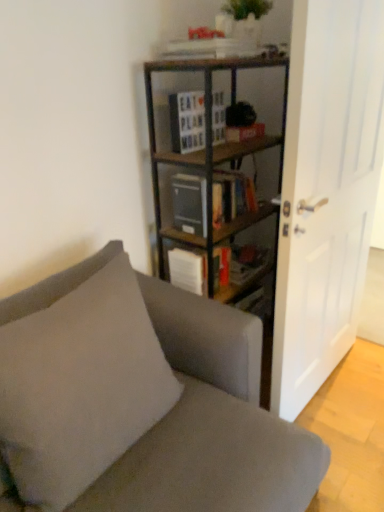
Question: From the image's perspective, would you say wooden sign at center, the 2th book ordered from the bottom, is positioned over wooden bookcase at center?

Choices:
 (A) no
 (B) yes

Answer: (B)

Question: Is wooden sign at center, the 2th book ordered from the bottom, behind wooden bookcase at center?

Choices:
 (A) no
 (B) yes

Answer: (B)

Question: Does wooden sign at center, the 2th book ordered from the bottom, have a lesser width compared to wooden bookcase at center?

Choices:
 (A) no
 (B) yes

Answer: (B)

Question: Is wooden sign at center, arranged as the 1th book when viewed from the top, at the right side of wooden bookcase at center?

Choices:
 (A) yes
 (B) no

Answer: (B)

Question: Does wooden sign at center, the 2th book ordered from the bottom, have a greater height compared to wooden bookcase at center?

Choices:
 (A) no
 (B) yes

Answer: (A)

Question: Relative to fabric couch at center, is white matte door at right in front or behind?

Choices:
 (A) front
 (B) behind

Answer: (B)

Question: Considering the relative positions of white matte door at right and fabric couch at center in the image provided, is white matte door at right to the left or to the right of fabric couch at center?

Choices:
 (A) left
 (B) right

Answer: (B)

Question: From a real-world perspective, is white matte door at right positioned above or below fabric couch at center?

Choices:
 (A) below
 (B) above

Answer: (B)

Question: In terms of height, does white matte door at right look taller or shorter compared to fabric couch at center?

Choices:
 (A) short
 (B) tall

Answer: (B)

Question: From the image's perspective, is matte gray bookshelf at center, marked as the second book in a top-to-bottom arrangement, located above or below wooden sign at center, arranged as the 1th book when viewed from the top?

Choices:
 (A) above
 (B) below

Answer: (B)

Question: Considering the positions of matte gray bookshelf at center, marked as the second book in a top-to-bottom arrangement, and wooden sign at center, the 2th book ordered from the bottom, in the image, is matte gray bookshelf at center, marked as the second book in a top-to-bottom arrangement, wider or thinner than wooden sign at center, the 2th book ordered from the bottom,?

Choices:
 (A) thin
 (B) wide

Answer: (B)

Question: Is point (244, 209) closer or farther from the camera than point (188, 112)?

Choices:
 (A) closer
 (B) farther

Answer: (B)

Question: Considering their positions, is matte gray bookshelf at center, which appears as the first book when ordered from the bottom, located in front of or behind wooden sign at center, arranged as the 1th book when viewed from the top?

Choices:
 (A) front
 (B) behind

Answer: (B)

Question: Does point (195, 244) appear closer or farther from the camera than point (306, 268)?

Choices:
 (A) closer
 (B) farther

Answer: (B)

Question: Considering their positions, is wooden bookshelf at center located in front of or behind white matte door at right?

Choices:
 (A) front
 (B) behind

Answer: (B)